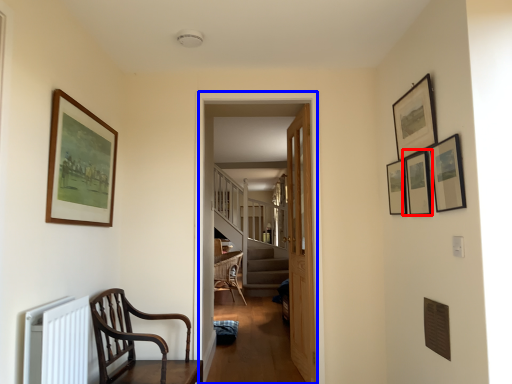
Question: Which object is further to the camera taking this photo, picture frame (highlighted by a red box) or corridor (highlighted by a blue box)?

Choices:
 (A) picture frame
 (B) corridor

Answer: (B)